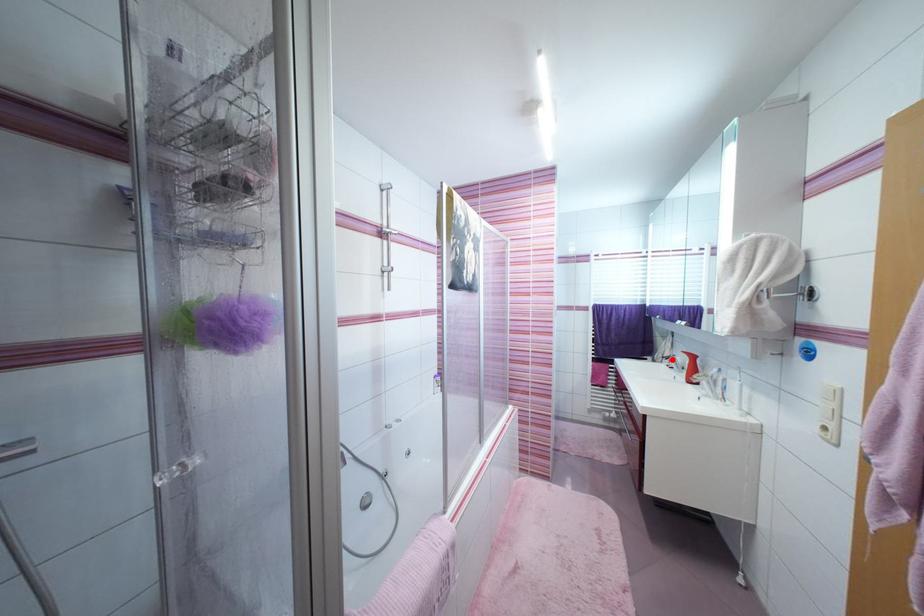
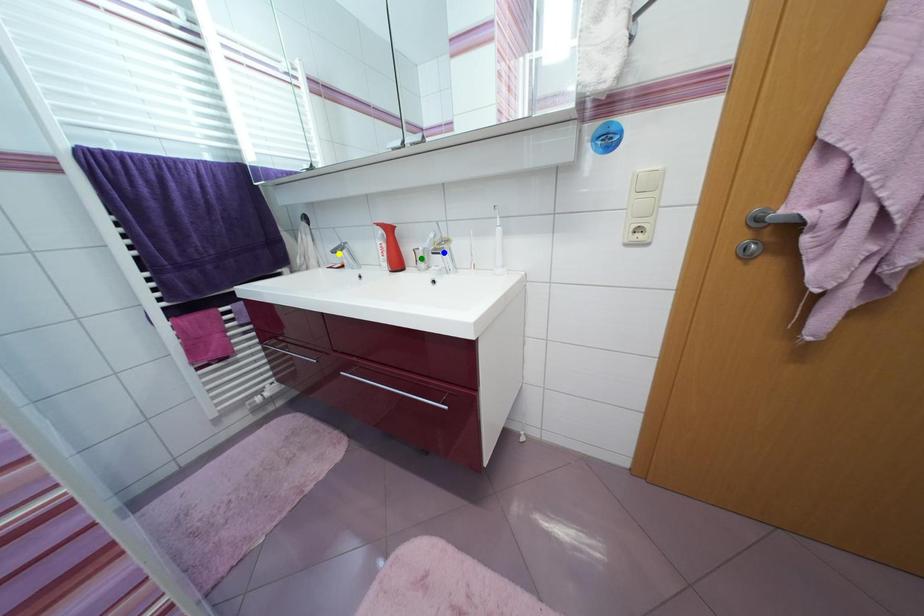
Question: I am providing you with two images of the same scene from different viewpoints. A red point is marked on the first image. You are given multiple points on the second image. Which point in image 2 represents the same 3d spot as the red point in image 1?

Choices:
 (A) green point
 (B) blue point
 (C) yellow point

Answer: (C)